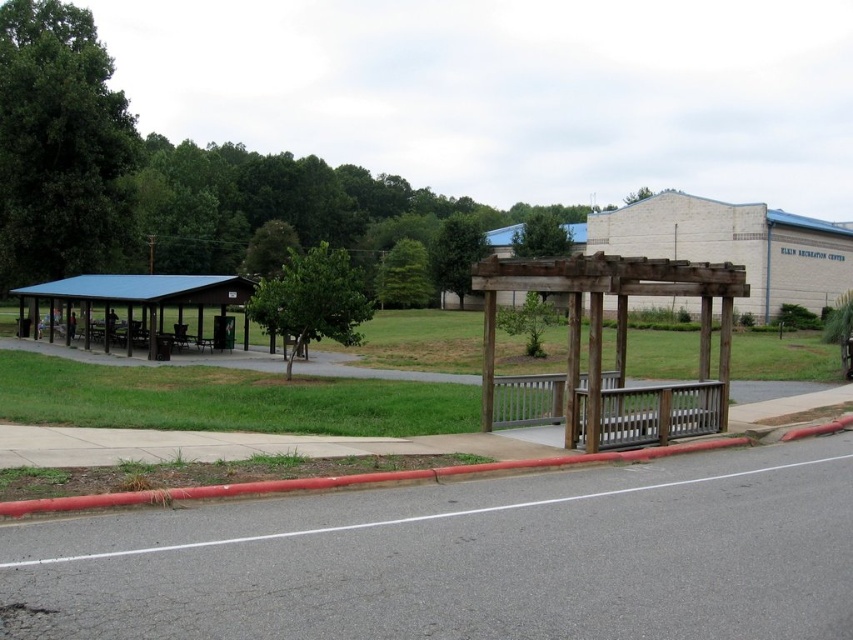
Question: Can you confirm if brown wooden gazebo at center is wider than wooden pergola at upper right?

Choices:
 (A) yes
 (B) no

Answer: (B)

Question: Which of these objects is positioned closest to the red rubber curb at lower left?

Choices:
 (A) brown wooden gazebo at center
 (B) wooden pergola at upper right

Answer: (A)

Question: Which object is positioned closest to the brown wooden gazebo at center?

Choices:
 (A) wooden pergola at upper right
 (B) red rubber curb at lower left

Answer: (B)

Question: Which of the following is the farthest from the observer?

Choices:
 (A) red rubber curb at lower left
 (B) brown wooden gazebo at center

Answer: (B)

Question: Where is brown wooden gazebo at center located in relation to red rubber curb at lower left in the image?

Choices:
 (A) above
 (B) below

Answer: (A)

Question: Is brown wooden gazebo at center closer to the viewer compared to red rubber curb at lower left?

Choices:
 (A) yes
 (B) no

Answer: (B)